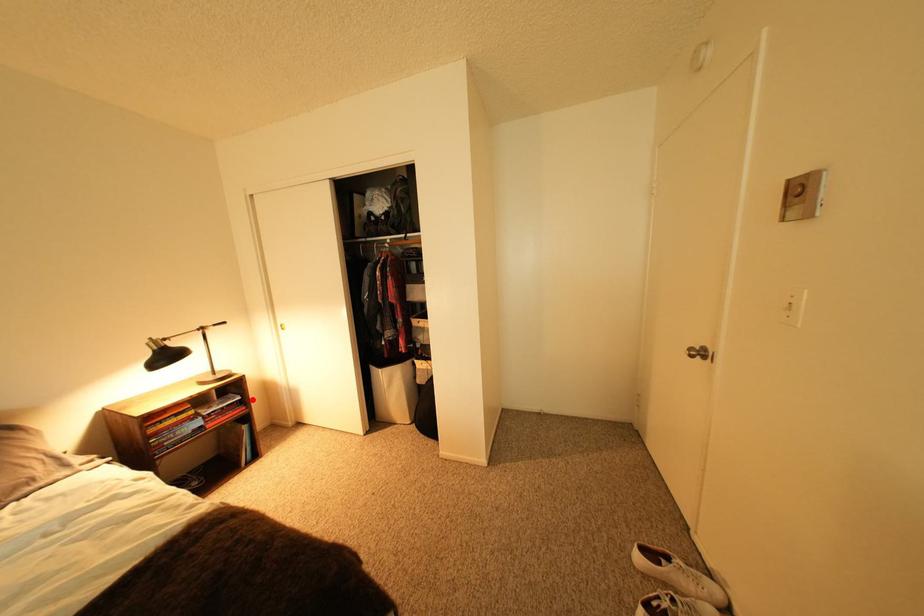
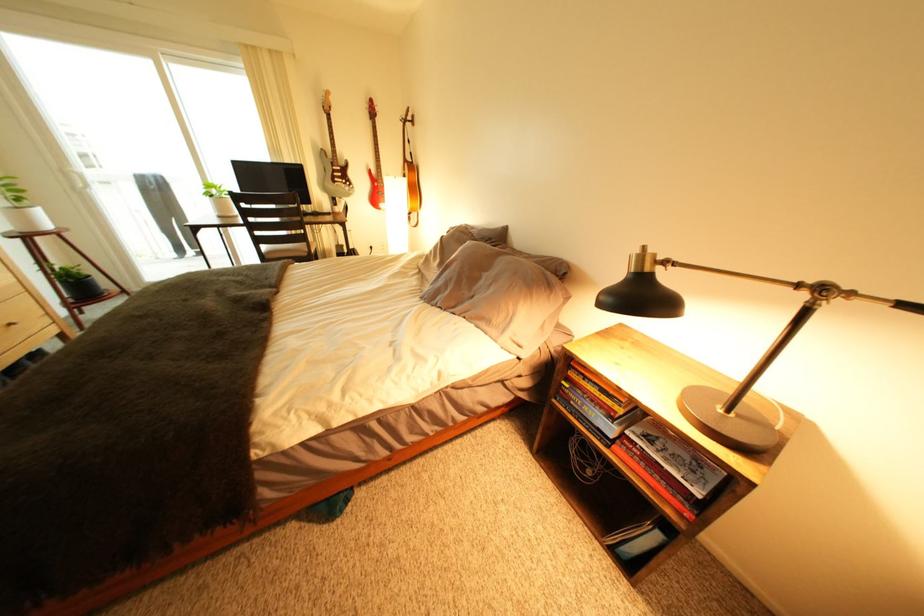
Where in the second image is the point corresponding to the highlighted location from the first image?

(712, 496)